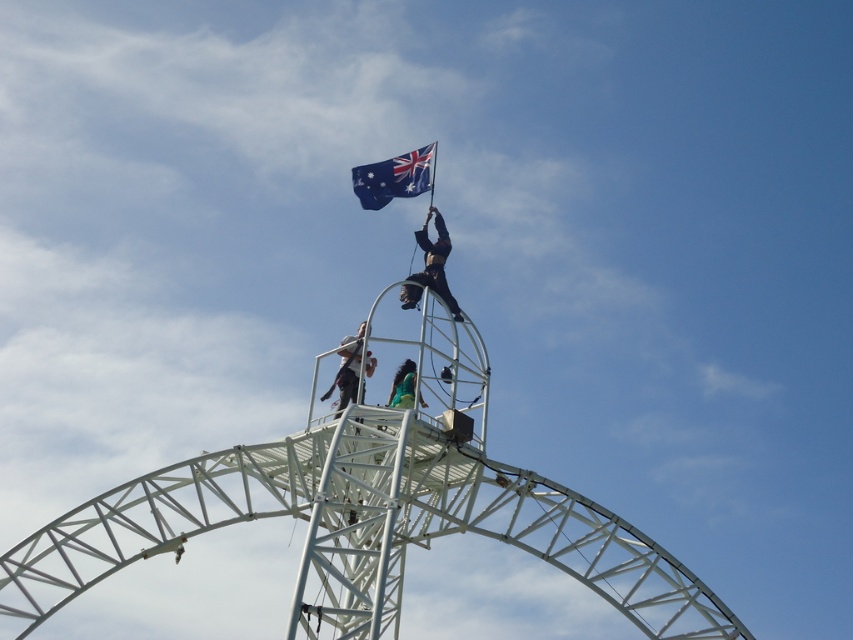
You are a photographer standing at the base of the large white metal structure. You want to capture a clear photo of the dark gray fabric at center. Considering the distance, is it feasible to take a clear photo without any zoom? Please explain your reasoning.

The dark gray fabric at center is 118.80 meters away from the viewer. Without zoom, capturing a clear photo at this distance would be challenging as the subject would appear small and possibly blurred. A zoom lens would be necessary to magnify the fabric and ensure clarity.

You are a photographer taking a picture of the scene. You want to ensure the blue fabric flag at top is visible above the black fabric person at upper center. Is this possible based on the current arrangement?

Yes, the blue fabric flag at top is positioned over the black fabric person at upper center, so it is visible above them in the photo.

You are a photographer trying to capture the blue fabric flag at top and the black fabric person at upper center in the same frame. Based on their sizes, which one will appear larger in the photo?

The black fabric person at upper center will appear larger in the photo because the blue fabric flag at top is shorter than the black fabric person at upper center.